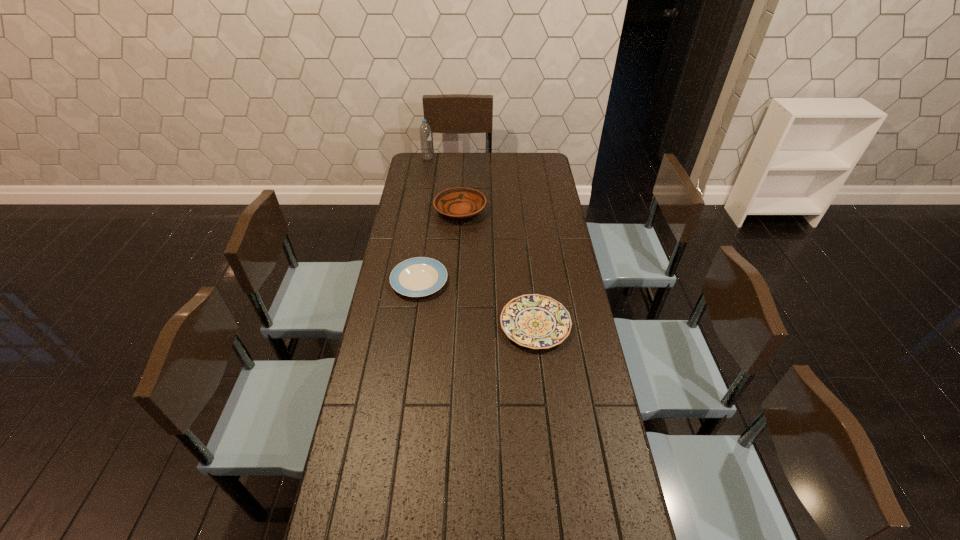
This screenshot has height=540, width=960. I want to click on object present at the right edge, so click(x=534, y=321).

In order to click on object present at the far left corner in this screenshot , I will do `click(425, 131)`.

In the image, there is a desktop. Identify the location of vacant space at the far edge. point(507,171).

I want to click on vacant position at the left edge of the desktop, so click(414, 241).

At what (x,y) coordinates should I click in order to perform the action: click on vacant region at the right edge of the desktop. Please return your answer as a coordinate pair (x, y). This screenshot has height=540, width=960. Looking at the image, I should click on pyautogui.click(x=624, y=528).

The width and height of the screenshot is (960, 540). Identify the location of vacant space at the far left corner of the desktop. (440, 153).

Image resolution: width=960 pixels, height=540 pixels. Identify the location of vacant point located between the rightmost object and the farthest plate. (497, 268).

The height and width of the screenshot is (540, 960). Identify the location of vacant space that is in between the tallest plate and the tallest object. (444, 185).

Locate an element on the screen. vacant area that lies between the farthest object and the second farthest object is located at coordinates (444, 185).

The width and height of the screenshot is (960, 540). I want to click on free spot between the second tallest object and the rightmost object, so click(x=497, y=268).